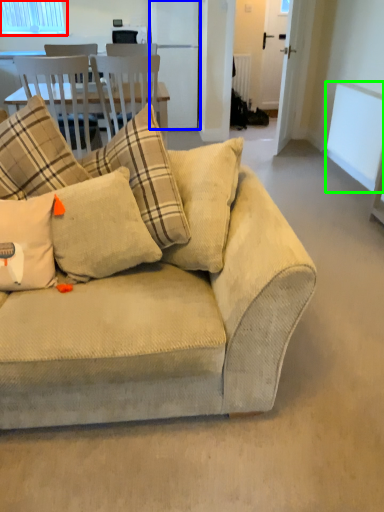
Question: Based on their relative distances, which object is farther from window (highlighted by a red box)? Choose from appliance (highlighted by a blue box) and window screen (highlighted by a green box).

Choices:
 (A) appliance
 (B) window screen

Answer: (B)